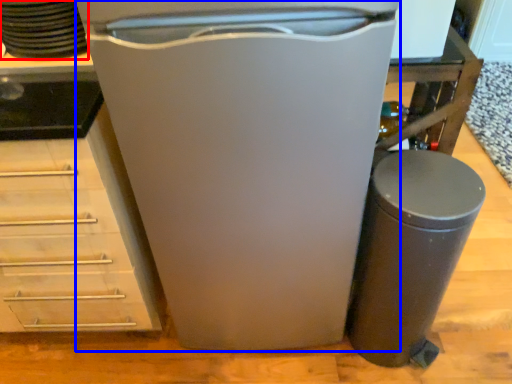
Question: Among these objects, which one is farthest to the camera, appliance (highlighted by a red box) or home appliance (highlighted by a blue box)?

Choices:
 (A) appliance
 (B) home appliance

Answer: (A)